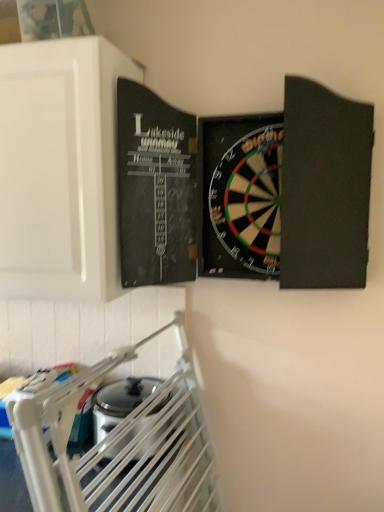
Find the location of a particular element. Image resolution: width=384 pixels, height=512 pixels. white matte cabinet at upper left is located at coordinates (60, 169).

What do you see at coordinates (60, 169) in the screenshot?
I see `white matte cabinet at upper left` at bounding box center [60, 169].

Measure the distance between point (108, 457) and camera.

Point (108, 457) is 1.07 meters from camera.

The width and height of the screenshot is (384, 512). What do you see at coordinates (119, 402) in the screenshot?
I see `satin silver toaster at lower left` at bounding box center [119, 402].

Find the location of a particular element. satin silver toaster at lower left is located at coordinates (119, 402).

Where is `white matte cabinet at upper left`? The image size is (384, 512). white matte cabinet at upper left is located at coordinates (60, 169).

Is white matte cabinet at upper left at the right side of satin silver toaster at lower left?

In fact, white matte cabinet at upper left is to the left of satin silver toaster at lower left.

Is white matte cabinet at upper left in front of or behind satin silver toaster at lower left in the image?

white matte cabinet at upper left is in front of satin silver toaster at lower left.

Is point (87, 52) positioned after point (125, 388)?

No, (87, 52) is closer to viewer.

From the image's perspective, is white matte cabinet at upper left positioned above or below satin silver toaster at lower left?

white matte cabinet at upper left is situated higher than satin silver toaster at lower left in the image.

Looking at this image, from a real-world perspective, does white matte cabinet at upper left sit lower than satin silver toaster at lower left?

No, from a real-world perspective, white matte cabinet at upper left is not beneath satin silver toaster at lower left.

Considering the sizes of objects white matte cabinet at upper left and satin silver toaster at lower left in the image provided, who is wider, white matte cabinet at upper left or satin silver toaster at lower left?

With larger width is white matte cabinet at upper left.

Considering the sizes of white matte cabinet at upper left and satin silver toaster at lower left in the image, is white matte cabinet at upper left taller or shorter than satin silver toaster at lower left?

Considering their sizes, white matte cabinet at upper left has more height than satin silver toaster at lower left.

Between white matte cabinet at upper left and satin silver toaster at lower left, which one has smaller size?

satin silver toaster at lower left is smaller.

Is white matte cabinet at upper left completely or partially outside of satin silver toaster at lower left?

Absolutely, white matte cabinet at upper left is external to satin silver toaster at lower left.

Is white matte cabinet at upper left far away from satin silver toaster at lower left?

No, white matte cabinet at upper left is in close proximity to satin silver toaster at lower left.

Is white matte cabinet at upper left aimed at satin silver toaster at lower left?

No, white matte cabinet at upper left does not turn towards satin silver toaster at lower left.

Can you tell me how much white matte cabinet at upper left and satin silver toaster at lower left differ in facing direction?

There is a 1.54-degree angle between the facing directions of white matte cabinet at upper left and satin silver toaster at lower left.

This screenshot has height=512, width=384. Find the location of `appliance that is under the white matte cabinet at upper left (from a real-world perspective)`. appliance that is under the white matte cabinet at upper left (from a real-world perspective) is located at coordinates (119, 402).

Considering the relative positions of satin silver toaster at lower left and white matte cabinet at upper left in the image provided, is satin silver toaster at lower left to the left of white matte cabinet at upper left from the viewer's perspective?

No, satin silver toaster at lower left is not to the left of white matte cabinet at upper left.

Does satin silver toaster at lower left lie in front of white matte cabinet at upper left?

No, it is behind white matte cabinet at upper left.

Is point (116, 419) positioned after point (94, 82)?

Yes, it is behind point (94, 82).

From the image's perspective, would you say satin silver toaster at lower left is shown under white matte cabinet at upper left?

Indeed, from the image's perspective, satin silver toaster at lower left is shown beneath white matte cabinet at upper left.

From a real-world perspective, who is located higher, satin silver toaster at lower left or white matte cabinet at upper left?

white matte cabinet at upper left.

Considering the relative sizes of satin silver toaster at lower left and white matte cabinet at upper left in the image provided, is satin silver toaster at lower left wider than white matte cabinet at upper left?

No, satin silver toaster at lower left is not wider than white matte cabinet at upper left.

Does satin silver toaster at lower left have a greater height compared to white matte cabinet at upper left?

Incorrect, the height of satin silver toaster at lower left is not larger of that of white matte cabinet at upper left.

Does satin silver toaster at lower left have a smaller size compared to white matte cabinet at upper left?

Indeed, satin silver toaster at lower left has a smaller size compared to white matte cabinet at upper left.

Can we say satin silver toaster at lower left lies outside white matte cabinet at upper left?

satin silver toaster at lower left lies outside white matte cabinet at upper left's area.

Is satin silver toaster at lower left far from white matte cabinet at upper left?

No, satin silver toaster at lower left is in close proximity to white matte cabinet at upper left.

Looking at this image, does satin silver toaster at lower left turn towards white matte cabinet at upper left?

No, satin silver toaster at lower left is not aimed at white matte cabinet at upper left.

How many degrees apart are the facing directions of satin silver toaster at lower left and white matte cabinet at upper left?

The angle between the facing direction of satin silver toaster at lower left and the facing direction of white matte cabinet at upper left is 1.54 degrees.

The height and width of the screenshot is (512, 384). Identify the location of cabinetry above the satin silver toaster at lower left (from a real-world perspective). coord(60,169).

This screenshot has width=384, height=512. Identify the location of appliance located below the white matte cabinet at upper left (from the image's perspective). (119, 402).

Locate an element on the screen. Image resolution: width=384 pixels, height=512 pixels. appliance that is behind the white matte cabinet at upper left is located at coordinates (119, 402).